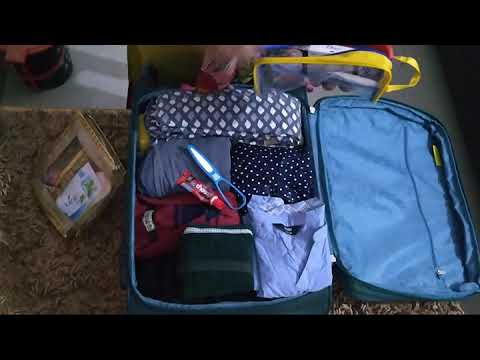
Locate an element on the screen. The image size is (480, 360). rug is located at coordinates (60, 267).